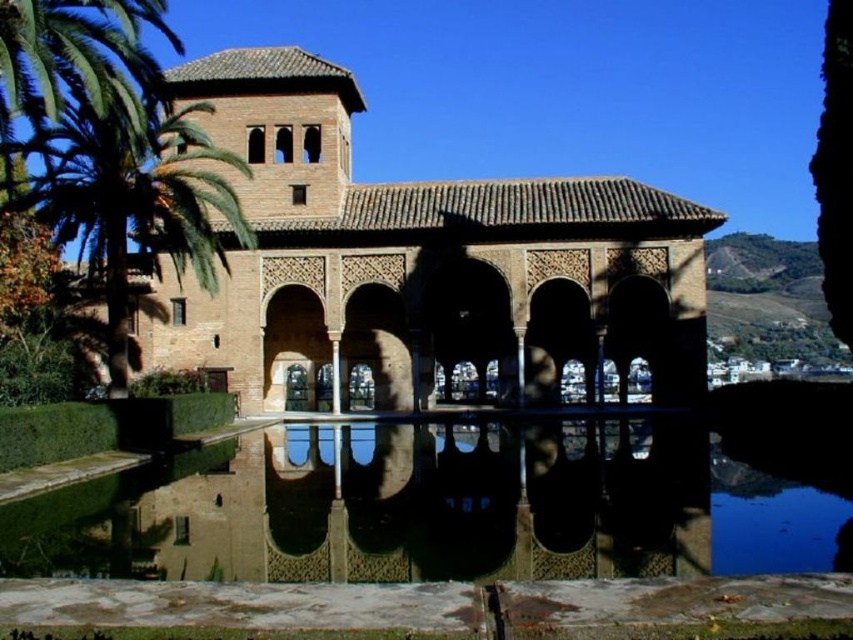
You are standing in front of the traditional architectural structure and want to find the clear glass water at center. Based on the coordinates provided, in which direction should you look to locate it?

The clear glass water at center is located at point coordinates, so you should look towards the center area to find it.

You are standing in front of the traditional architectural structure and want to take a photo. There are two points of interest marked as point 1 at location (x=219, y=548) and point 2 at (x=207, y=280). Which point is closer to your current position?

Point 1 at location (x=219, y=548) is closer to the camera than point 2 at (x=207, y=280). Therefore, point 1 is closer to your current position.

You are a visitor standing in front of the traditional building. You see the clear glass water at center and the green leafy palm tree at upper left. Which object is located directly above the other?

The green leafy palm tree at upper left is directly above the clear glass water at center.